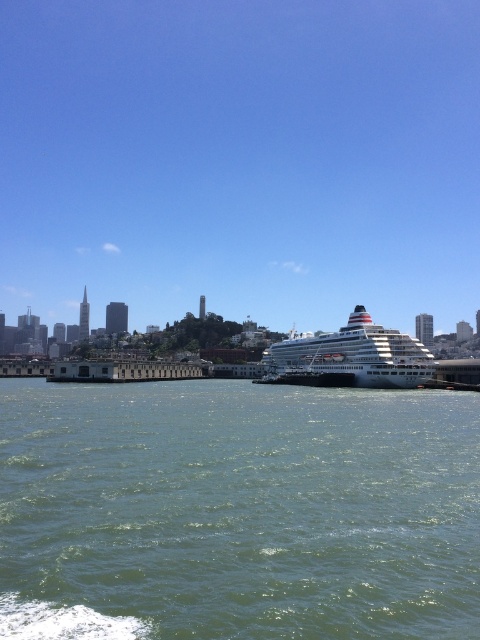
Who is positioned more to the right, green water at center or white glossy cruise ship at center?

From the viewer's perspective, white glossy cruise ship at center appears more on the right side.

Does green water at center appear over white glossy cruise ship at center?

No, green water at center is not above white glossy cruise ship at center.

Between point (427, 605) and point (362, 332), which one is positioned in front?

Point (427, 605) is more forward.

In order to click on green water at center in this screenshot , I will do `click(238, 512)`.